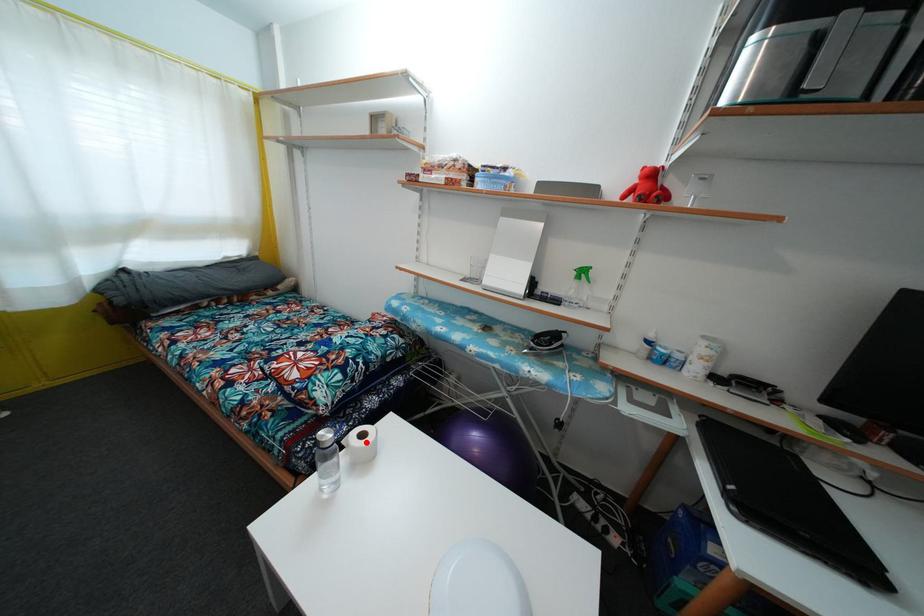
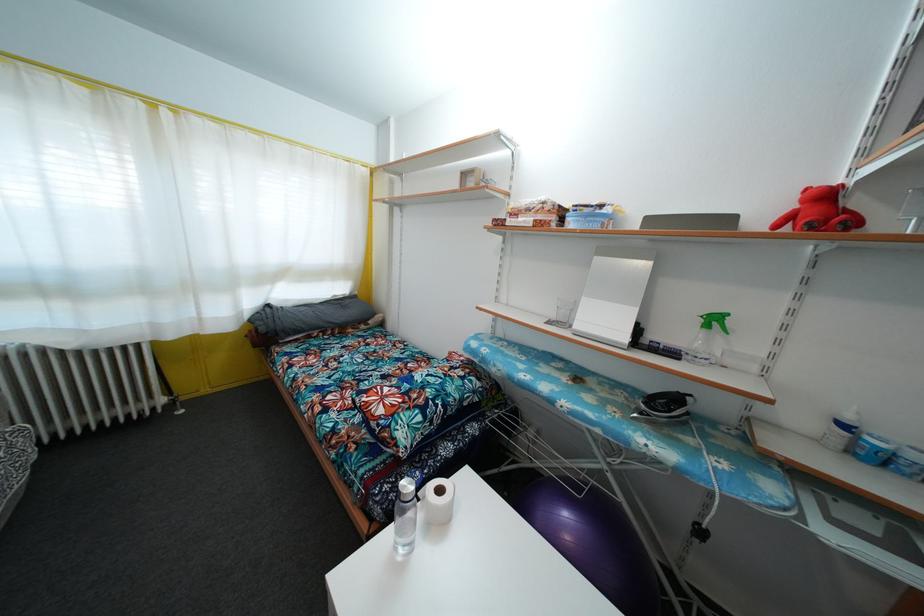
In the second image, find the point that corresponds to the highlighted location in the first image.

(444, 498)